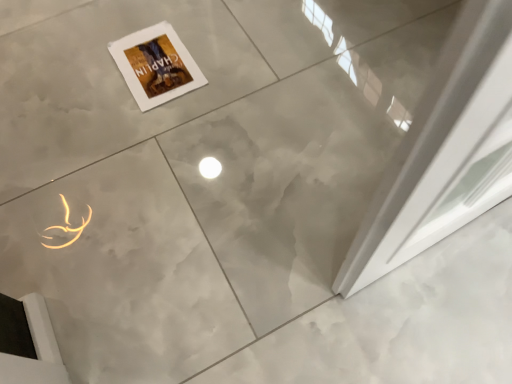
Where is `unoccupied area in front of white paper at upper left`? unoccupied area in front of white paper at upper left is located at coordinates (169, 132).